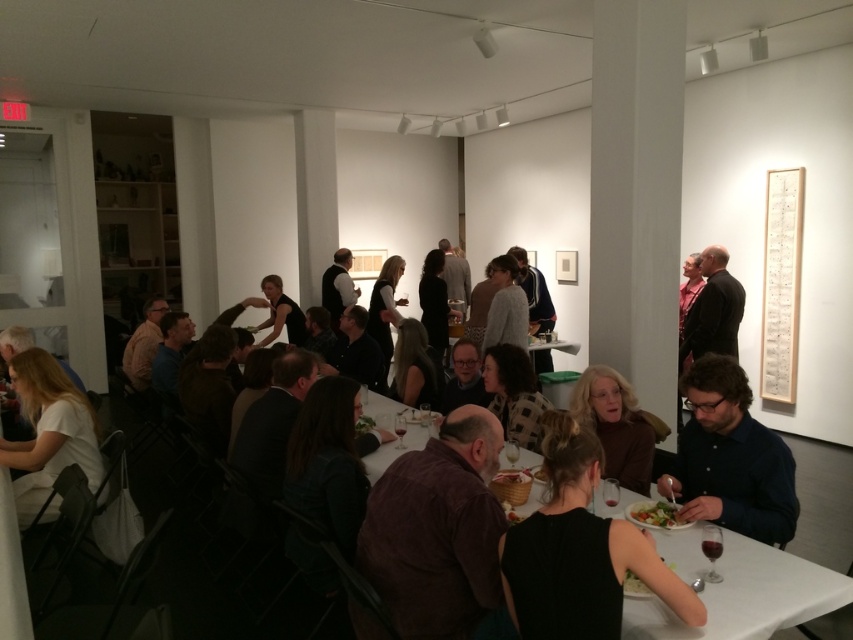
You are a photographer at this gallery event and want to capture both the dark brown suit at center and the black matte shirt at center in a single frame. Since the camera has a limited field of view, you need to know which of these two is narrower so you can position yourself accordingly. Which one has a smaller width?

The dark brown suit at center has a smaller width than the black matte shirt at center, so you should position yourself to account for its narrower frame.

You are at a gallery event and see two guests wearing the dark blue shirt at lower right and the white matte shirt at lower left. Which guest is positioned more to your right side?

The dark blue shirt at lower right is positioned to the right of the white matte shirt at lower left, so the guest wearing the dark blue shirt at lower right is more to your right side.

You are a photographer at the event and need to capture both the dark brown textured shirt at center and the matte brown sweater at center in a single shot. Which one should you focus on first to ensure both are in frame?

The dark brown textured shirt at center is taller than the matte brown sweater at center, so you should focus on the dark brown textured shirt at center first to ensure both are in frame.